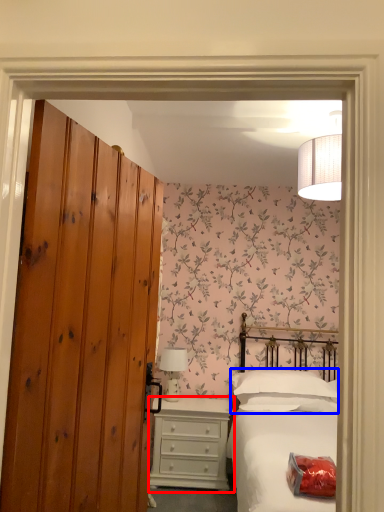
Question: Among these objects, which one is farthest to the camera, chest of drawers (highlighted by a red box) or pillow (highlighted by a blue box)?

Choices:
 (A) chest of drawers
 (B) pillow

Answer: (A)